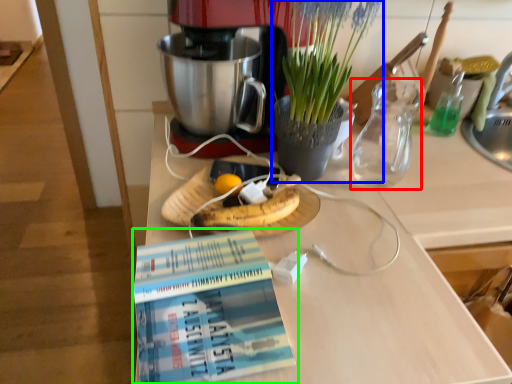
Question: Based on their relative distances, which object is farther from tea pot (highlighted by a red box)? Choose from houseplant (highlighted by a blue box) and book (highlighted by a green box).

Choices:
 (A) houseplant
 (B) book

Answer: (B)